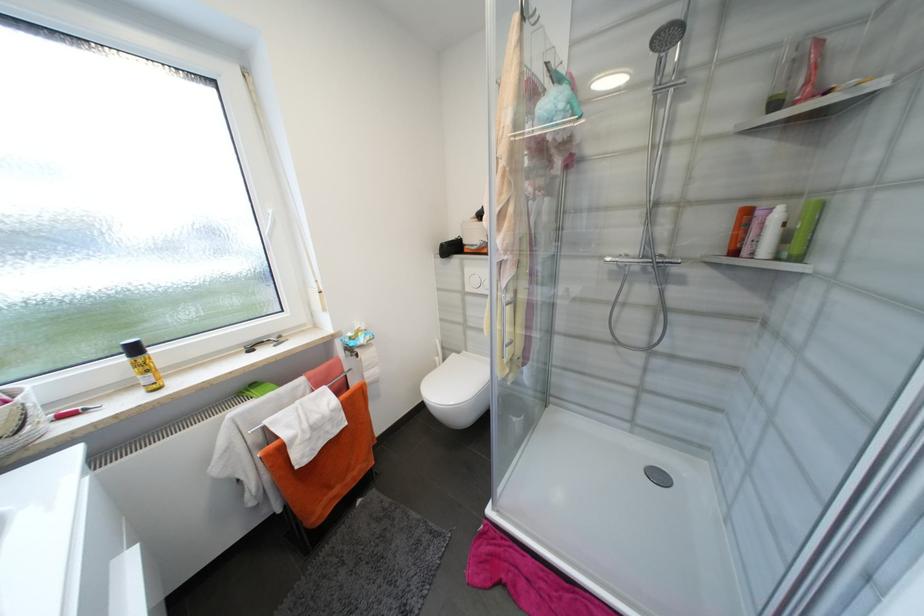
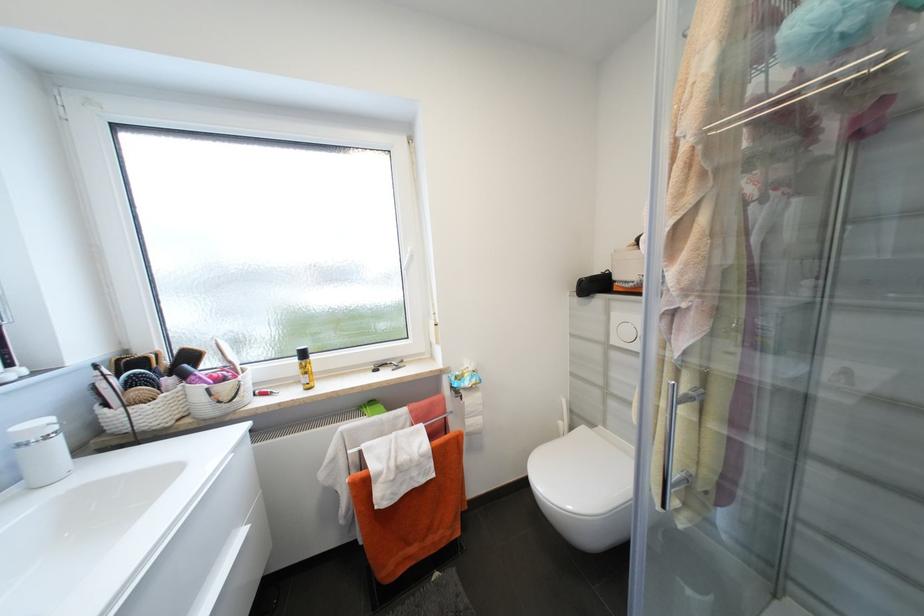
Question: The camera is either moving clockwise (left) or counter-clockwise (right) around the object. The first image is from the beginning of the video and the second image is from the end. Is the camera moving left or right when shooting the video?

Choices:
 (A) Left
 (B) Right

Answer: (B)